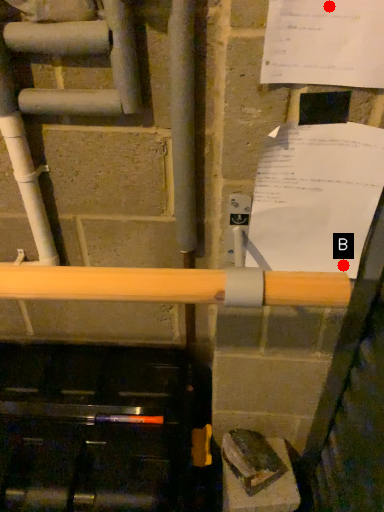
Question: Two points are circled on the image, labeled by A and B beside each circle. Which point is farther to the camera?

Choices:
 (A) A is further
 (B) B is further

Answer: (B)